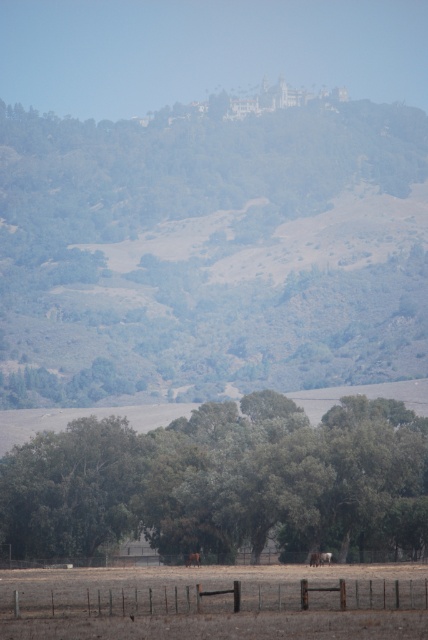
Question: Does green leafy tree at center have a greater width compared to brown furry horse at lower center?

Choices:
 (A) yes
 (B) no

Answer: (A)

Question: Estimate the real-world distances between objects in this image. Which object is closer to the brown furry horse at lower center?

Choices:
 (A) green leafy tree at lower center
 (B) rusty metal fence at lower center
 (C) green leafy tree at center

Answer: (A)

Question: Is green leafy tree at center to the right of brown furry horse at lower center from the viewer's perspective?

Choices:
 (A) yes
 (B) no

Answer: (B)

Question: Estimate the real-world distances between objects in this image. Which object is closer to the green leafy tree at center?

Choices:
 (A) rusty metal fence at lower center
 (B) brown furry horse at lower center

Answer: (B)

Question: Considering the relative positions of green leafy tree at center and brown furry horse at lower center in the image provided, where is green leafy tree at center located with respect to brown furry horse at lower center?

Choices:
 (A) below
 (B) above

Answer: (B)

Question: Which object is positioned closest to the brown furry horse at lower center?

Choices:
 (A) green leafy tree at lower center
 (B) green leafy tree at center
 (C) rusty metal fence at lower center

Answer: (A)